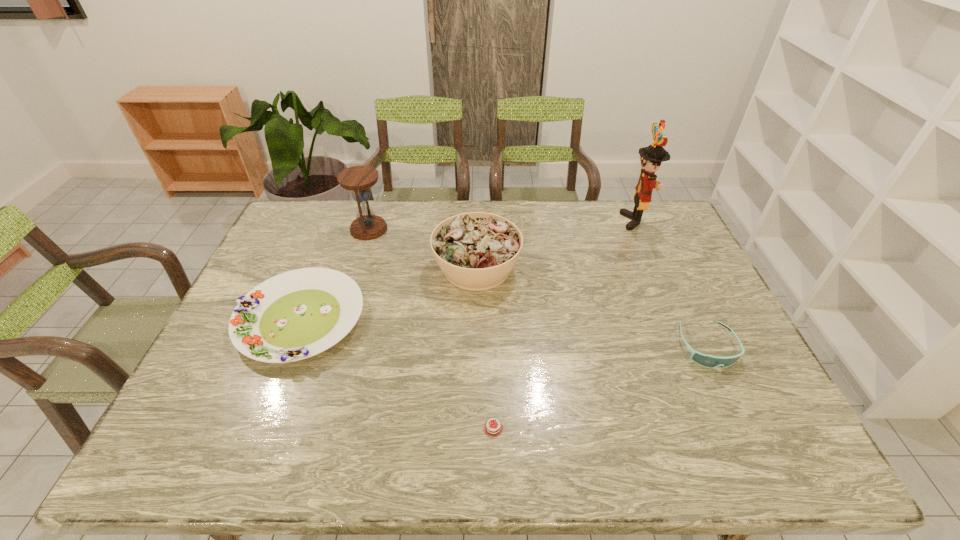
Identify the location of goggles located in the right edge section of the desktop. The height and width of the screenshot is (540, 960). (705, 360).

In order to click on object situated at the far right corner in this screenshot , I will do [651, 157].

You are a GUI agent. You are given a task and a screenshot of the screen. Output one action in this format:
    pyautogui.click(x=<x>, y=<y>)
    Task: Click on the blank area at the far edge
    
    Given the screenshot: What is the action you would take?
    pyautogui.click(x=603, y=206)

Find the location of a particular element. This screenshot has height=540, width=960. blank area at the near edge is located at coordinates (583, 464).

Identify the location of vacant space at the left edge of the desktop. This screenshot has width=960, height=540. (247, 373).

Image resolution: width=960 pixels, height=540 pixels. Find the location of `vacant space at the right edge`. vacant space at the right edge is located at coordinates (717, 328).

This screenshot has height=540, width=960. What are the coordinates of `vacant space at the far left corner of the desktop` in the screenshot? It's located at (321, 235).

In the image, there is a desktop. At what (x,y) coordinates should I click in order to perform the action: click on vacant space at the near left corner. Please return your answer as a coordinate pair (x, y). Looking at the image, I should click on (199, 462).

Image resolution: width=960 pixels, height=540 pixels. I want to click on vacant region between the tallest object and the goggles, so click(x=671, y=284).

Where is `vacant area that lies between the nearest object and the salad`? vacant area that lies between the nearest object and the salad is located at coordinates (485, 348).